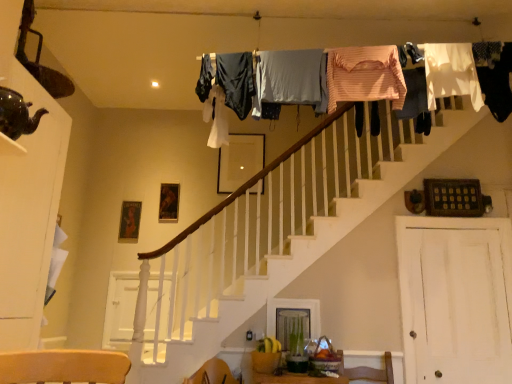
Question: Is wooden picture frame at center surrounded by shiny dark green teapot at upper left?

Choices:
 (A) yes
 (B) no

Answer: (B)

Question: Is shiny dark green teapot at upper left turned away from wooden picture frame at center?

Choices:
 (A) yes
 (B) no

Answer: (B)

Question: Can you confirm if shiny dark green teapot at upper left is shorter than wooden picture frame at center?

Choices:
 (A) no
 (B) yes

Answer: (B)

Question: Are shiny dark green teapot at upper left and wooden picture frame at center far apart?

Choices:
 (A) yes
 (B) no

Answer: (A)

Question: Is the depth of shiny dark green teapot at upper left less than that of wooden picture frame at center?

Choices:
 (A) yes
 (B) no

Answer: (A)

Question: From the image's perspective, is shiny dark green teapot at upper left over wooden picture frame at center?

Choices:
 (A) no
 (B) yes

Answer: (A)

Question: Could you tell me if light gray fabric at upper center, acting as the 3th clothing starting from the left, is facing white painted wood at lower left, the 2th barn door when ordered from front to back?

Choices:
 (A) yes
 (B) no

Answer: (B)

Question: Is light gray fabric at upper center, which ranks as the fifth clothing in right-to-left order, positioned in front of white painted wood at lower left, the 1th barn door viewed from the back?

Choices:
 (A) no
 (B) yes

Answer: (B)

Question: Can you confirm if light gray fabric at upper center, acting as the 3th clothing starting from the left, is bigger than white painted wood at lower left, the 2th barn door when ordered from front to back?

Choices:
 (A) yes
 (B) no

Answer: (A)

Question: Is the surface of light gray fabric at upper center, acting as the 3th clothing starting from the left, in direct contact with white painted wood at lower left, the 1th barn door viewed from the back?

Choices:
 (A) no
 (B) yes

Answer: (A)

Question: From a real-world perspective, is light gray fabric at upper center, which ranks as the fifth clothing in right-to-left order, on white painted wood at lower left, the first barn door when ordered from left to right?

Choices:
 (A) no
 (B) yes

Answer: (B)

Question: Can you confirm if light gray fabric at upper center, acting as the 3th clothing starting from the left, is smaller than white painted wood at lower left, the first barn door when ordered from left to right?

Choices:
 (A) no
 (B) yes

Answer: (A)

Question: Are dark blue fabric at upper center, positioned as the first clothing in left-to-right order, and white painted wood at lower left, the 1th barn door viewed from the back, beside each other?

Choices:
 (A) no
 (B) yes

Answer: (A)